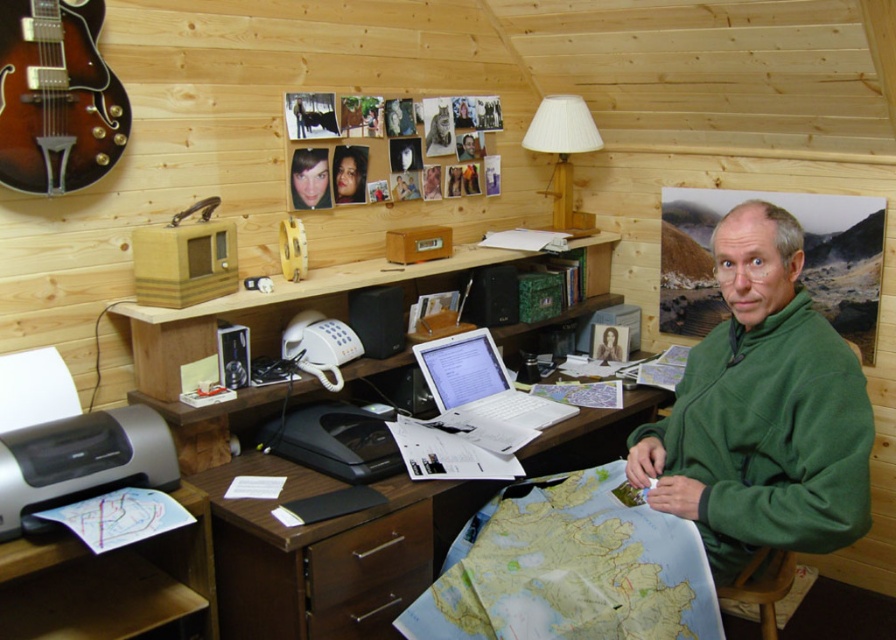
You are standing in the home office shown in the image. You need to place a small plant on the desk such that it is exactly at the position of the brown wood drawer at lower center. Where should you place the plant relative to the desk?

Place the plant at the 2D coordinates point [367,556] on the desk, which corresponds to the location of the brown wood drawer at lower center.

You are sitting at the brown wood computer desk at center and want to reach the white glossy laptop at center. Which direction should you move to get closer to the laptop?

The brown wood computer desk at center is in front of the white glossy laptop at center, so you should move backward to get closer to the white glossy laptop at center.